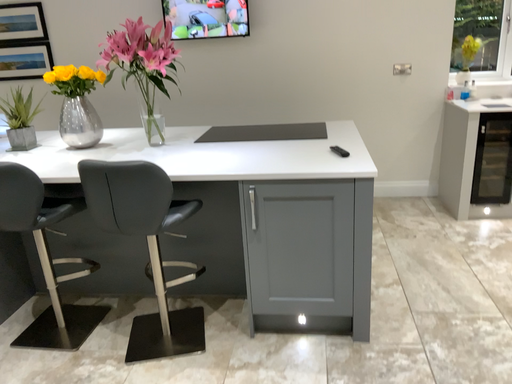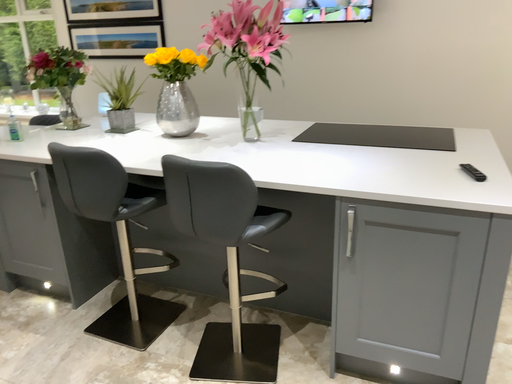
Question: How did the camera likely rotate when shooting the video?

Choices:
 (A) rotated left
 (B) rotated right

Answer: (A)